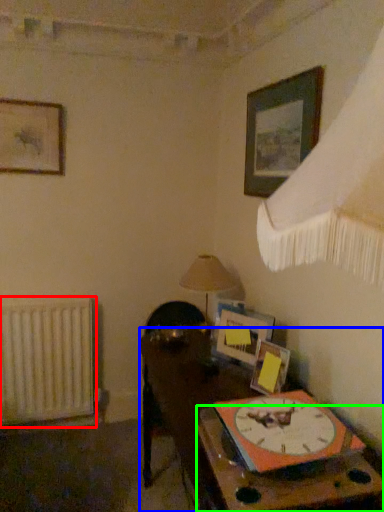
Question: Estimate the real-world distances between objects in this image. Which object is farther from radiator (highlighted by a red box), table (highlighted by a blue box) or table (highlighted by a green box)?

Choices:
 (A) table
 (B) table

Answer: (B)